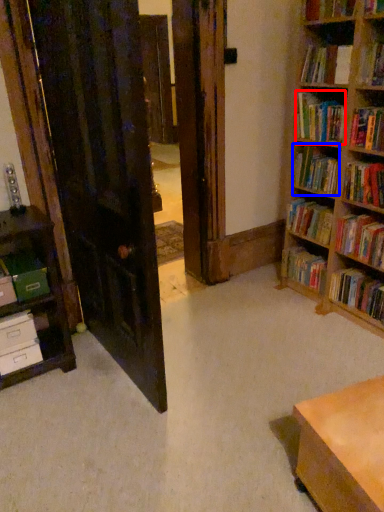
Question: Which of the following is the farthest to the observer, book (highlighted by a red box) or book (highlighted by a blue box)?

Choices:
 (A) book
 (B) book

Answer: (B)